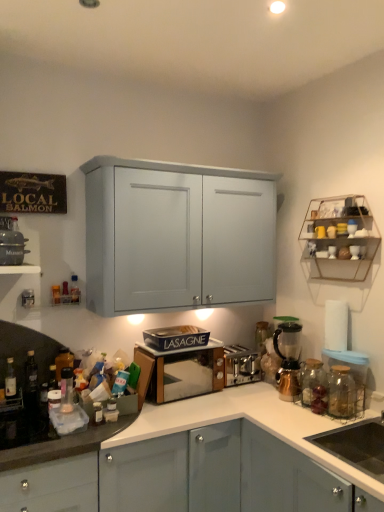
Find the location of a particular element. The height and width of the screenshot is (512, 384). vacant space to the right of white matte paper towel at right is located at coordinates (347, 352).